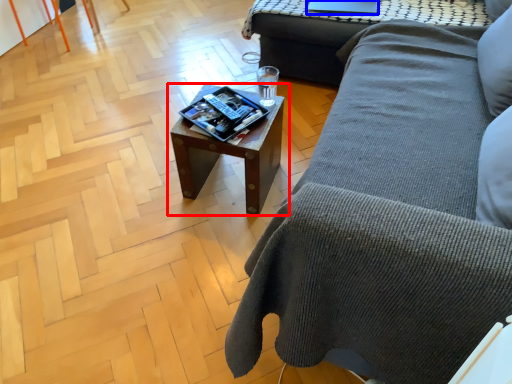
Question: Which point is closer to the camera, table (highlighted by a red box) or laptop (highlighted by a blue box)?

Choices:
 (A) table
 (B) laptop

Answer: (A)